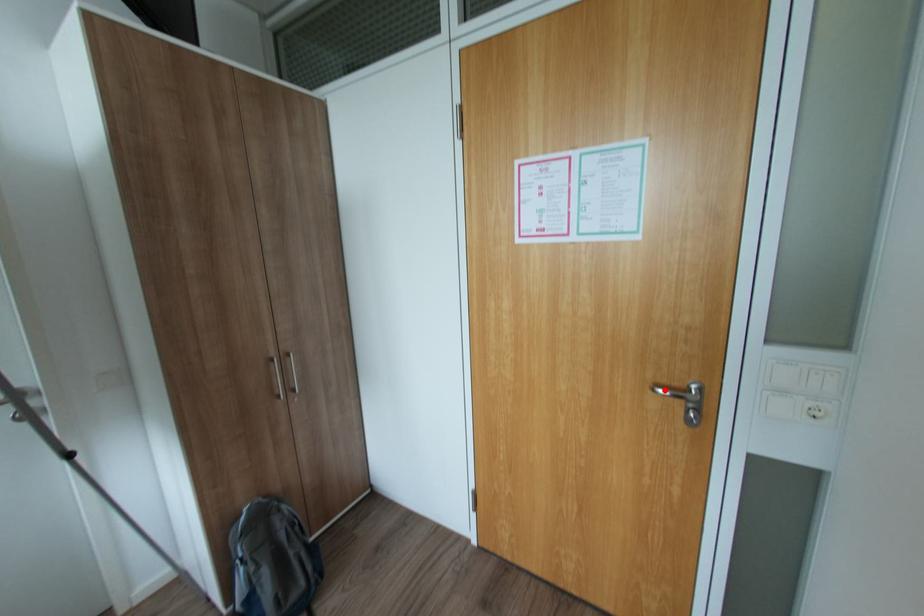
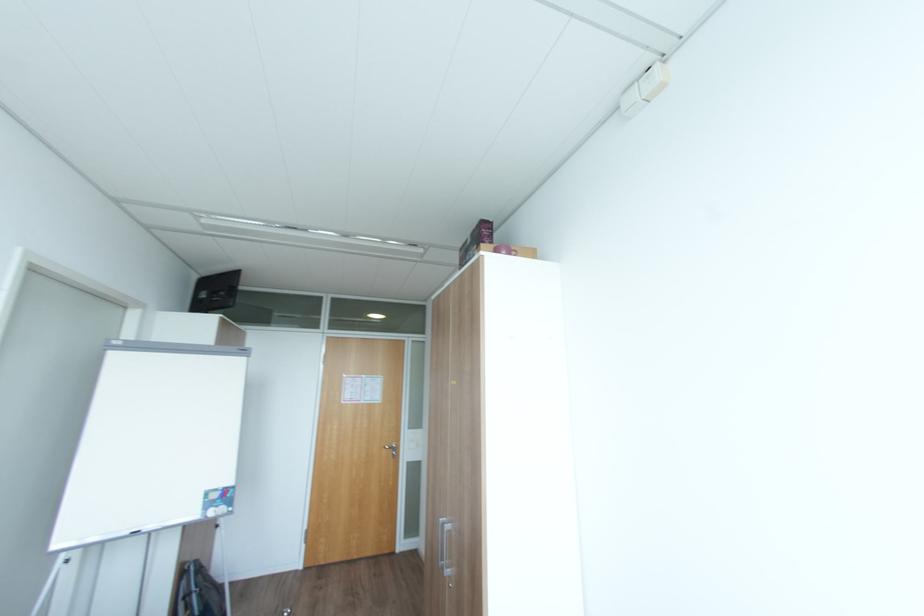
Where in the second image is the point corresponding to the highlighted location from the first image?

(392, 448)